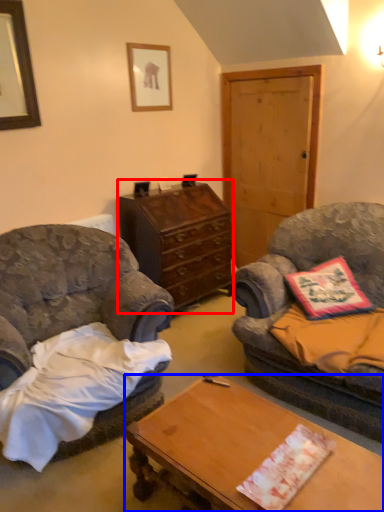
Question: Which point is closer to the camera, cabinetry (highlighted by a red box) or desk (highlighted by a blue box)?

Choices:
 (A) cabinetry
 (B) desk

Answer: (B)